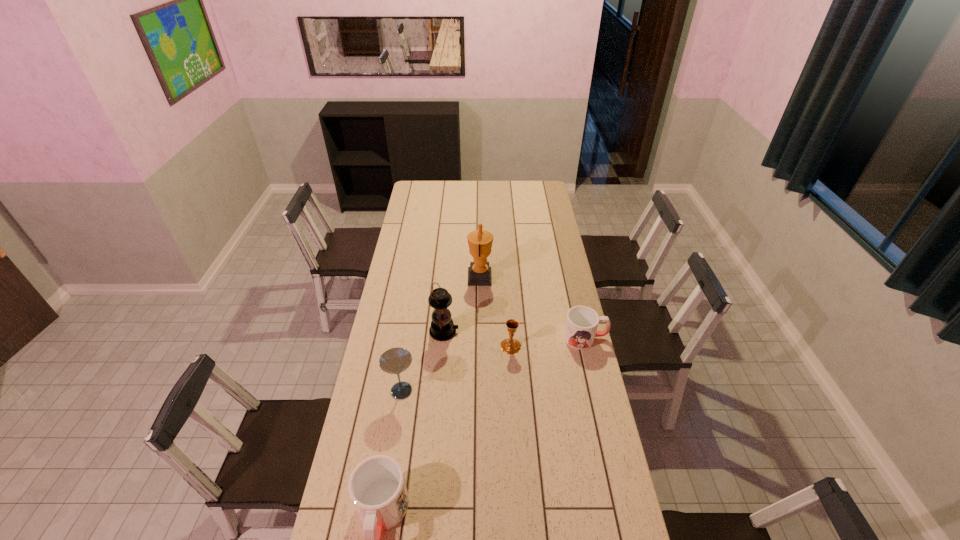
Identify the location of vacant space in between the chalice and the award. (495, 312).

The width and height of the screenshot is (960, 540). In order to click on free area in between the shorter mug and the award in this screenshot , I will do `click(533, 308)`.

At what (x,y) coordinates should I click in order to perform the action: click on free space between the farthest object and the second tallest object. Please return your answer as a coordinate pair (x, y). Image resolution: width=960 pixels, height=540 pixels. Looking at the image, I should click on (462, 305).

This screenshot has width=960, height=540. Identify the location of free space that is in between the second object from right to left and the third object from left to right. (477, 339).

Where is `empty space that is in between the martini and the third object from left to right`? The width and height of the screenshot is (960, 540). empty space that is in between the martini and the third object from left to right is located at coordinates (422, 361).

Identify which object is located as the fifth nearest to the fifth object from left to right. Please provide its 2D coordinates. Your answer should be formatted as a tuple, i.e. [(x, y)], where the tuple contains the x and y coordinates of a point satisfying the conditions above.

[(377, 488)]

The image size is (960, 540). I want to click on object identified as the third closest to the left mug, so click(510, 346).

Locate an element on the screen. This screenshot has width=960, height=540. vacant region that satisfies the following two spatial constraints: 1. at the front of the farthest object with handles; 2. on the left side of the chalice is located at coordinates (480, 346).

The height and width of the screenshot is (540, 960). Find the location of `vacant area that satisfies the following two spatial constraints: 1. on the side of the shorter mug with the handle; 2. on the front side of the second object from right to left`. vacant area that satisfies the following two spatial constraints: 1. on the side of the shorter mug with the handle; 2. on the front side of the second object from right to left is located at coordinates (587, 346).